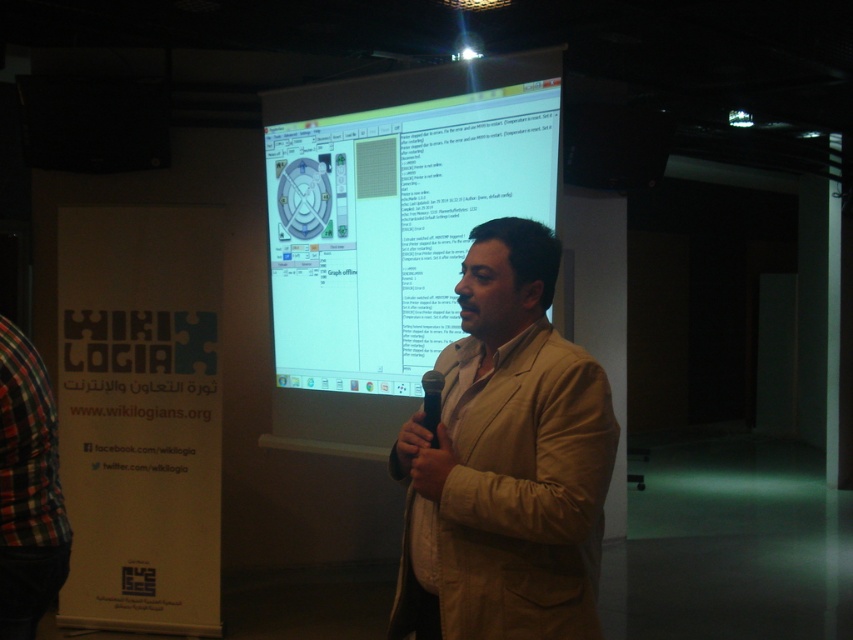
You are an attendee at the presentation and want to take a photo of the white glossy projection screen at center and the black plastic microphone at center. Which one should you focus on first if you want to capture both in a single shot without moving your camera?

The white glossy projection screen at center is located above the black plastic microphone at center, so you should focus on the white glossy projection screen at center first to ensure both are in frame.

You are an event organizer who needs to place a 1.5 meter wide banner between the white glossy projection screen at center and the beige fabric coat at center. Can you fit the banner between them?

The white glossy projection screen at center might be wider than beige fabric coat at center, so the banner may or may not fit depending on the exact width difference. Please measure the space between them first.

You are an event organizer who needs to set up a camera to capture both the beige fabric coat at center and the black plastic microphone at center. Since the camera has a fixed focus, you need to know which object is lower in the frame to ensure both are in view. Which object is positioned lower?

The beige fabric coat at center is located below the black plastic microphone at center, so the beige fabric coat at center is positioned lower in the frame.